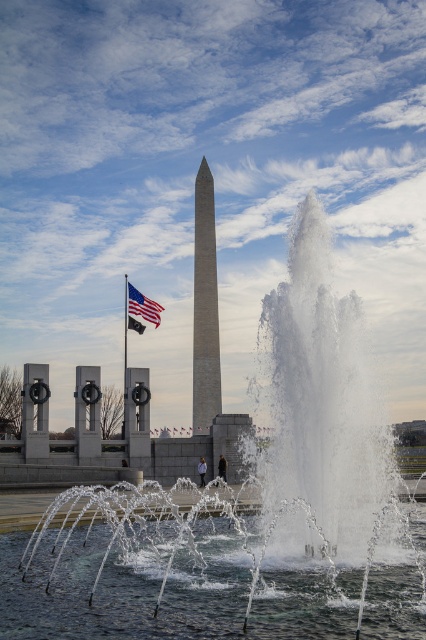
You are standing in the outdoor scene and want to move from point A to point B. Point A is located at point (195, 195) and point B is at point (141, 294). Since you can only move forward, will you be able to reach point B without turning around?

Point (195, 195) is further to the viewer than point (141, 294). Since you can only move forward, you will not be able to reach point B at (141, 294) without turning around because it is behind you relative to your starting position.

You are a photographer trying to capture the smooth gray obelisk at center and the american flag at center in the same frame. Based on their positions, which object should you focus on first to ensure both are in the frame?

The smooth gray obelisk at center is positioned over the american flag at center, so you should focus on the american flag at center first to ensure both are in the frame.